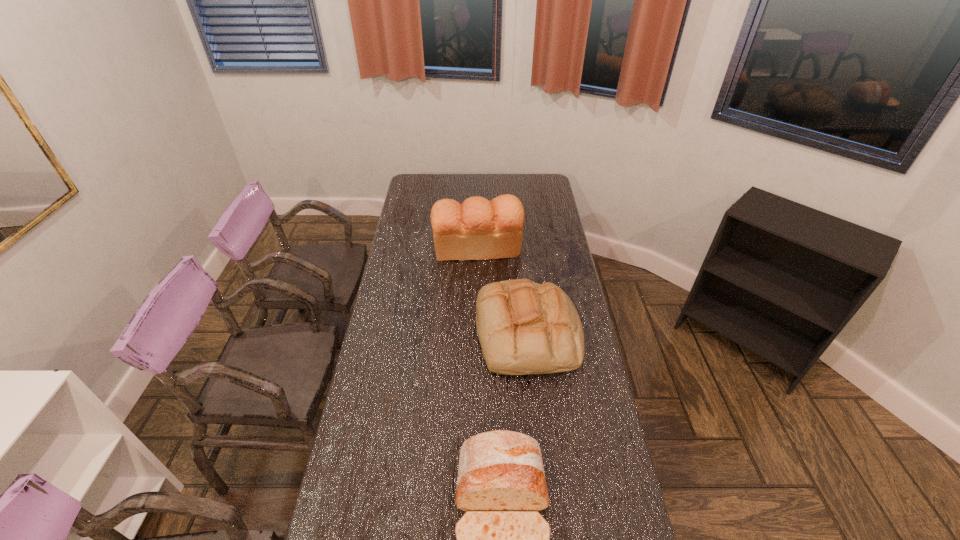
Where is `free space at the far left corner of the desktop`? The height and width of the screenshot is (540, 960). free space at the far left corner of the desktop is located at coordinates (424, 183).

At what (x,y) coordinates should I click in order to perform the action: click on vacant region at the far right corner of the desktop. Please return your answer as a coordinate pair (x, y). The height and width of the screenshot is (540, 960). Looking at the image, I should click on (526, 191).

This screenshot has height=540, width=960. What are the coordinates of `object that is the closest to the shortest bread` in the screenshot? It's located at (524, 327).

I want to click on the second closest object to the second shortest object, so click(502, 539).

Locate which bread is the second closest to the shortest bread. Please provide its 2D coordinates. Your answer should be formatted as a tuple, i.e. [(x, y)], where the tuple contains the x and y coordinates of a point satisfying the conditions above.

[(478, 229)]

The width and height of the screenshot is (960, 540). Identify the location of bread that can be found as the closest to the tallest object. (524, 327).